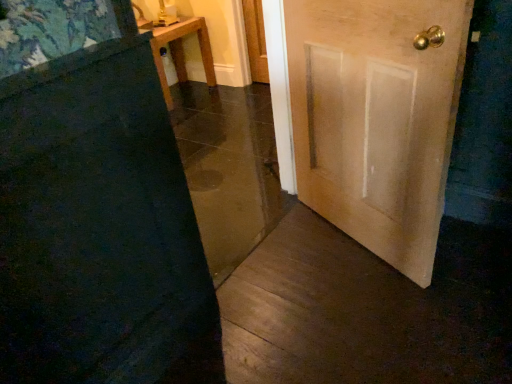
Identify the location of free space in front of light brown wooden door at right, the second door viewed from the left. The width and height of the screenshot is (512, 384). (379, 318).